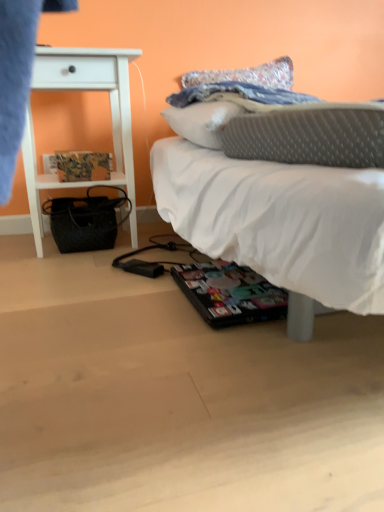
Question: Is white soft bed at center turned away from printed paper magazine at left?

Choices:
 (A) yes
 (B) no

Answer: (B)

Question: Are white soft bed at center and printed paper magazine at left located far from each other?

Choices:
 (A) no
 (B) yes

Answer: (A)

Question: Considering the relative sizes of white soft bed at center and printed paper magazine at left in the image provided, is white soft bed at center bigger than printed paper magazine at left?

Choices:
 (A) yes
 (B) no

Answer: (A)

Question: Does white soft bed at center have a lesser height compared to printed paper magazine at left?

Choices:
 (A) yes
 (B) no

Answer: (B)

Question: Is the position of white soft bed at center more distant than that of printed paper magazine at left?

Choices:
 (A) no
 (B) yes

Answer: (A)

Question: From the image's perspective, does white soft bed at center appear higher than printed paper magazine at left?

Choices:
 (A) yes
 (B) no

Answer: (B)

Question: Can you confirm if white wood nightstand at left is positioned to the left of white soft bed at center?

Choices:
 (A) no
 (B) yes

Answer: (B)

Question: Are white wood nightstand at left and white soft bed at center located far from each other?

Choices:
 (A) no
 (B) yes

Answer: (A)

Question: Is white wood nightstand at left further to camera compared to white soft bed at center?

Choices:
 (A) no
 (B) yes

Answer: (B)

Question: Does white wood nightstand at left have a larger size compared to white soft bed at center?

Choices:
 (A) yes
 (B) no

Answer: (B)

Question: From a real-world perspective, is white wood nightstand at left physically above white soft bed at center?

Choices:
 (A) yes
 (B) no

Answer: (A)

Question: From the image's perspective, is white wood nightstand at left below white soft bed at center?

Choices:
 (A) yes
 (B) no

Answer: (B)

Question: Is white wood nightstand at left turned away from printed paper magazine at left?

Choices:
 (A) no
 (B) yes

Answer: (B)